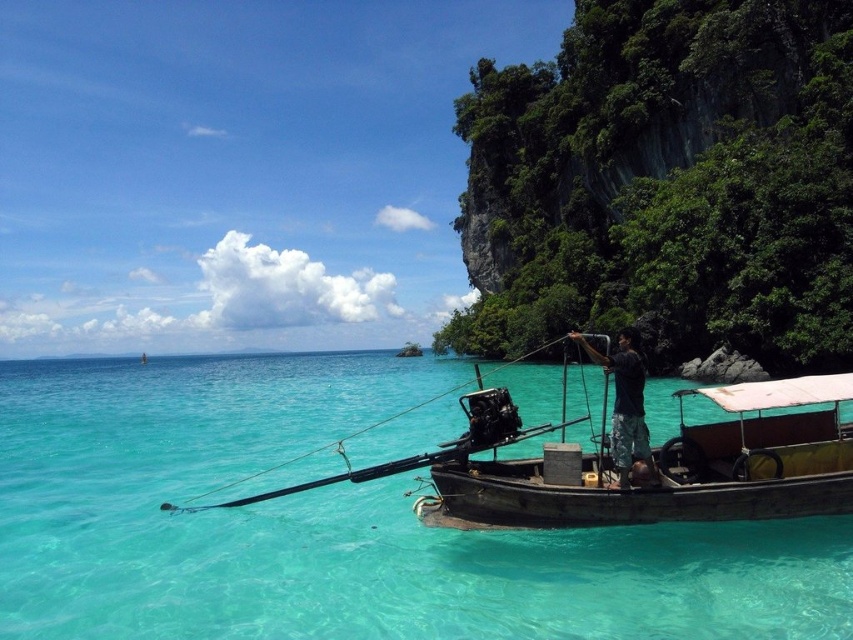
You are a photographer standing on the rocky cliff and want to take a photo of the clear turquoise water at center and the dark gray fabric shirt at center. Which object will appear larger in your photo?

The clear turquoise water at center will appear larger in the photo because it is much taller than the dark gray fabric shirt at center.

You are a photographer planning to capture the wooden boat at lower right and the wooden fishing pole at center in a single shot. Considering their heights, which object will appear taller in the photo?

The wooden fishing pole at center will appear taller in the photo since the wooden boat at lower right has a lesser height compared to it.

You are standing on the dock and see the wooden fishing pole at center in the boat. If you want to reach it without getting into the water, can you do so by stretching your arm? Your arm is 2.5 meters long.

The wooden fishing pole at center is 49.52 feet from viewer, which is approximately 15.1 meters. Since your arm is only 2.5 meters long, you cannot reach it by stretching your arm.